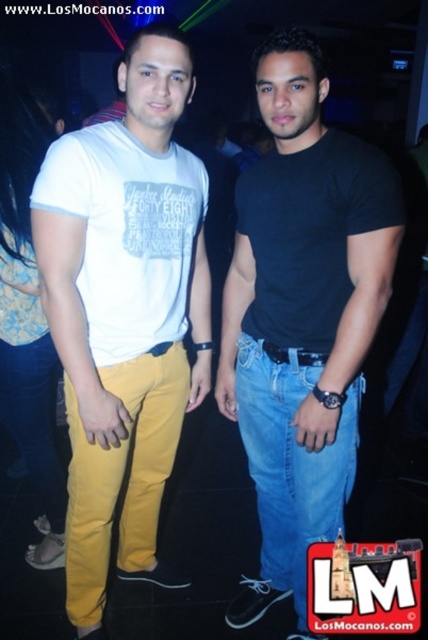
I want to click on matte yellow pants at left, so click(x=124, y=308).

Locate an element on the screen. The image size is (428, 640). matte yellow pants at left is located at coordinates (124, 308).

Between point (98, 612) and point (293, 477), which one is positioned behind?

The point (98, 612) is more distant.

Which is in front, point (189, 92) or point (321, 524)?

Point (189, 92) is in front.

Between point (76, 582) and point (246, 397), which one is positioned behind?

Point (246, 397)

Find the location of `matte yellow pants at left`. matte yellow pants at left is located at coordinates (124, 308).

Is black matte t-shirt at center wider than blue denim jeans at center?

Indeed, black matte t-shirt at center has a greater width compared to blue denim jeans at center.

Does point (323, 433) come farther from viewer compared to point (342, 448)?

No, it is in front of (342, 448).

Image resolution: width=428 pixels, height=640 pixels. I want to click on black matte t-shirt at center, so click(302, 316).